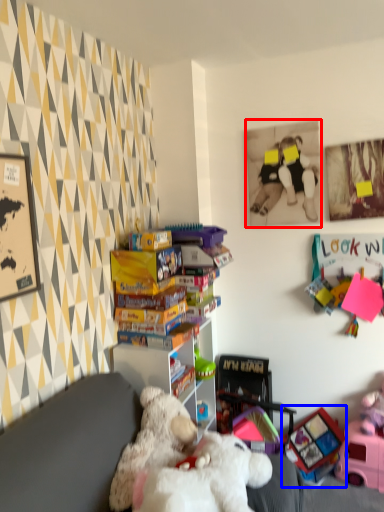
Question: Among these objects, which one is farthest to the camera, picture frame (highlighted by a red box) or toy (highlighted by a blue box)?

Choices:
 (A) picture frame
 (B) toy

Answer: (B)